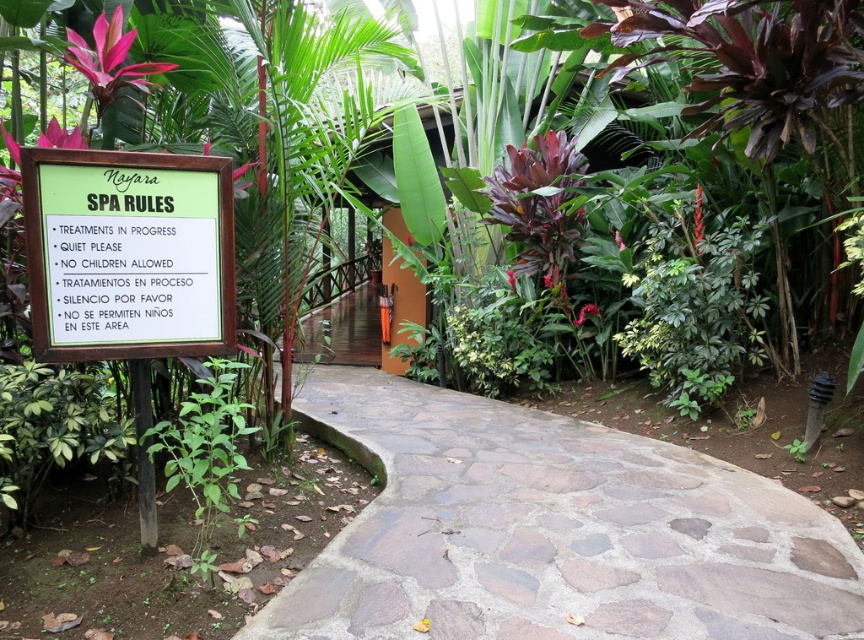
You are a guest at the spa and want to read the rules displayed on the green wooden sign at upper left. However, there is a green leafy plant at lower left blocking your view. Can you move closer to the sign to read it better?

The green wooden sign at upper left is closer to the viewer than the green leafy plant at lower left, so you can move closer to the sign to read it better without obstruction from the plant.

You are a maintenance worker who needs to place a 1.5 meter long decorative fence between the natural stone pathway at center and the green leafy plant at lower left. Can you fit the fence between them without moving either object?

The natural stone pathway at center and green leafy plant at lower left are 1.58 meters apart from each other. Since the fence is 1.5 meters long, it can fit between them as the distance is slightly larger than the fence length.

You are planning to walk along the natural stone pathway at center and pass by the green wooden sign at upper left. Considering their sizes, which one would you notice first as you approach the area?

The natural stone pathway at center has a larger size compared to the green wooden sign at upper left, so you would notice the natural stone pathway at center first due to its bigger size.